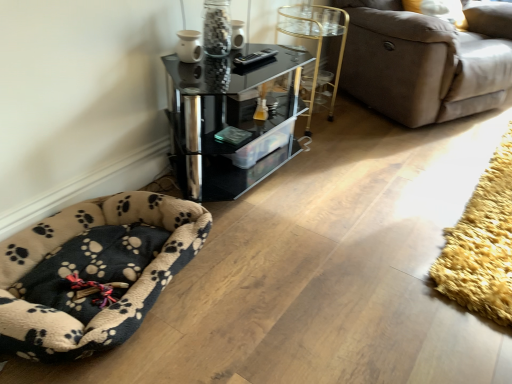
Find the location of a particular element. The height and width of the screenshot is (384, 512). vacant area that lies between black glass table at upper center and yellow shaggy rug at lower right is located at coordinates (384, 185).